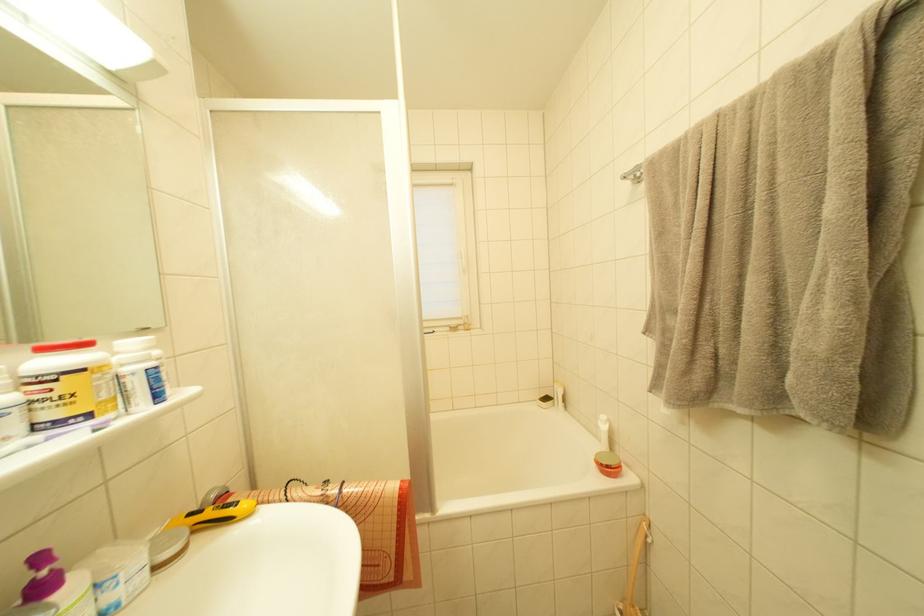
The image size is (924, 616). Find the location of `jar with red lid`. jar with red lid is located at coordinates (67, 384).